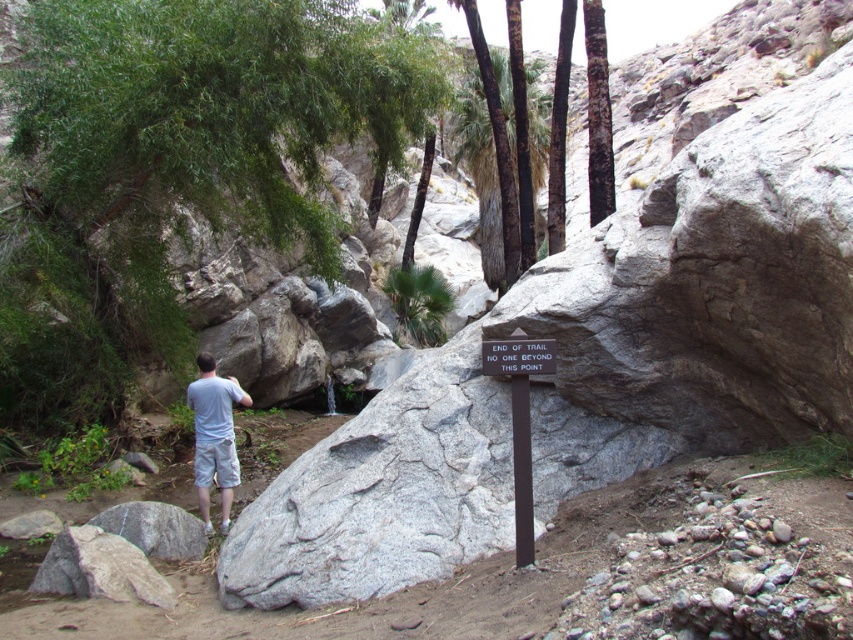
Question: Which object is farther from the camera taking this photo?

Choices:
 (A) smooth dark brown tree trunk at center
 (B) black metal sign at center
 (C) brown rough bark tree at upper center
 (D) green leafy palm tree at center

Answer: (D)

Question: Which of the following is the farthest from the observer?

Choices:
 (A) green leafy tree at upper left
 (B) black metal sign at center

Answer: (A)

Question: Does black metal sign at center have a greater width compared to green leafy palm tree at center?

Choices:
 (A) yes
 (B) no

Answer: (B)

Question: Estimate the real-world distances between objects in this image. Which object is closer to the black plastic sign at center?

Choices:
 (A) black metal sign at center
 (B) smooth dark brown tree trunk at center
 (C) green leafy palm tree at center

Answer: (A)

Question: Can you confirm if smooth dark brown tree trunk at center is wider than brown rough bark tree at upper center?

Choices:
 (A) no
 (B) yes

Answer: (B)

Question: Is green leafy palm tree at center to the left of brown rough bark tree at upper center from the viewer's perspective?

Choices:
 (A) no
 (B) yes

Answer: (B)